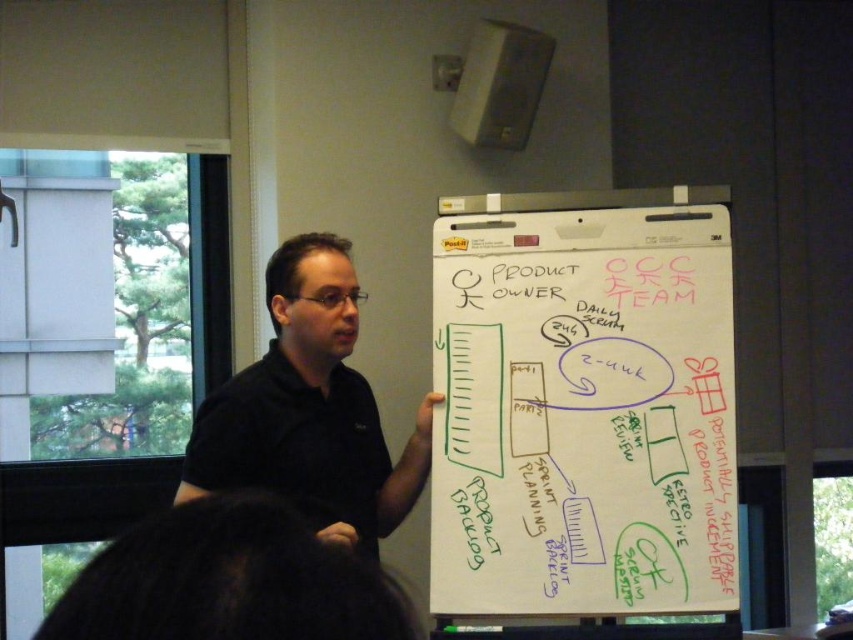
You are a student sitting in the front row of a classroom and see the whiteboard at center and the black shirt at center. Which object is closer to you?

The whiteboard at center is closer to you because it is further to the viewer than the black shirt at center.

You are an attendee in the meeting and want to take a photo of the whiteboard at center. The camera you have can only focus on objects within a 0.5 radius around a point. If you focus your camera at point [582,410], will the whiteboard at center be in focus?

The whiteboard at center is located exactly at point [582,410], so focusing the camera at that point will ensure the whiteboard at center is in focus.

You are a student attending a lecture and see the man in a black shirt at center and the whiteboard at center. Which object is located to the right of the other?

The whiteboard at center is positioned on the right side of black shirt at center.